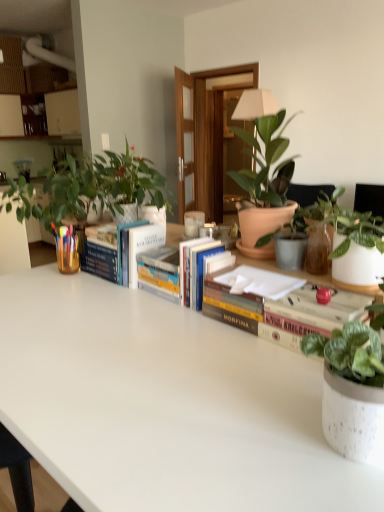
Question: Is point (264, 228) positioned closer to the camera than point (344, 358)?

Choices:
 (A) closer
 (B) farther

Answer: (B)

Question: Relative to speckled ceramic pot at lower right, which ranks as the 5th houseplant in left-to-right order, is terracotta pot plant at center, which is counted as the 4th houseplant, starting from the right, in front or behind?

Choices:
 (A) behind
 (B) front

Answer: (A)

Question: Which of these objects is positioned farthest from the green matte plant at left, arranged as the 1th houseplant when viewed from the left?

Choices:
 (A) hardcover book at center, which is the 2th paperback book in right-to-left order
 (B) green matte plant at upper left, positioned as the fifth houseplant in right-to-left order
 (C) white matte table at center
 (D) white matte paper at center, positioned as the first paperback book in front-to-back order
 (E) speckled ceramic pot at lower right, which ranks as the 5th houseplant in left-to-right order

Answer: (E)

Question: Estimate the real-world distances between objects in this image. Which object is closer to the white matte table at center?

Choices:
 (A) hardcover book at center, which is the 3th book from right to left
 (B) green matte plant at left, which appears as the 6th houseplant when viewed from the right
 (C) hardcover books at center, acting as the 2th book starting from the right
 (D) speckled white pot at upper right, the 6th houseplant from the left
 (E) green matte plant at upper left, positioned as the fifth houseplant in right-to-left order

Answer: (C)